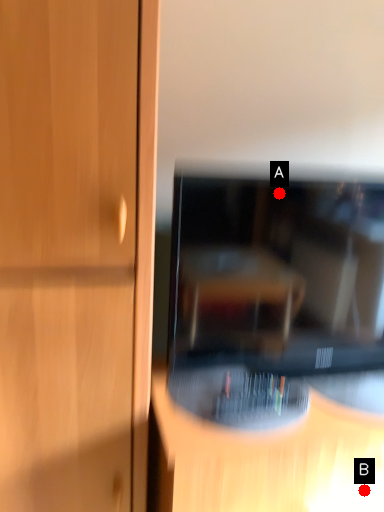
Question: Two points are circled on the image, labeled by A and B beside each circle. Which point is closer to the camera?

Choices:
 (A) A is closer
 (B) B is closer

Answer: (A)